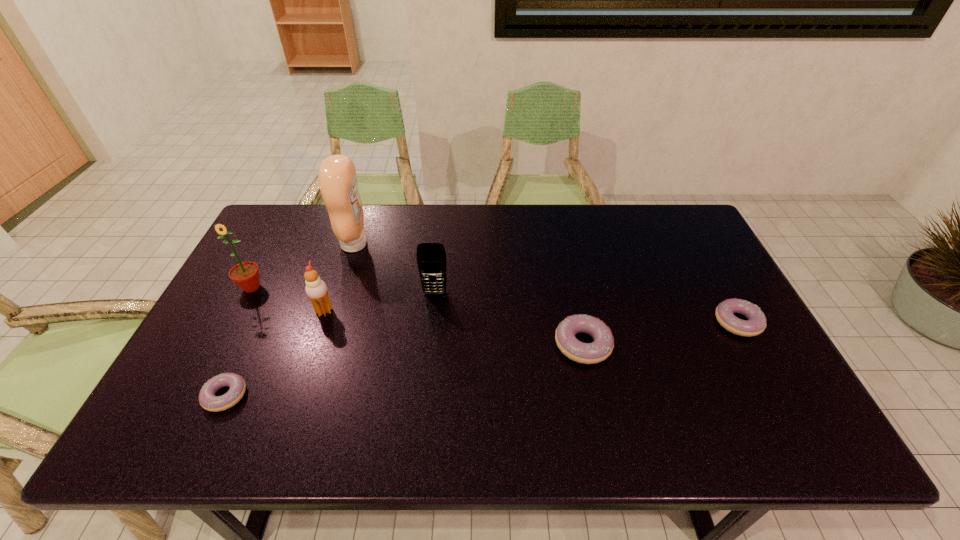
If the aim is uniform spacing by inserting an additional doughnut among them, please point to a vacant space for this new doughnut. Please provide its 2D coordinates. Your answer should be formatted as a tuple, i.e. [(x, y)], where the tuple contains the x and y coordinates of a point satisfying the conditions above.

[(413, 369)]